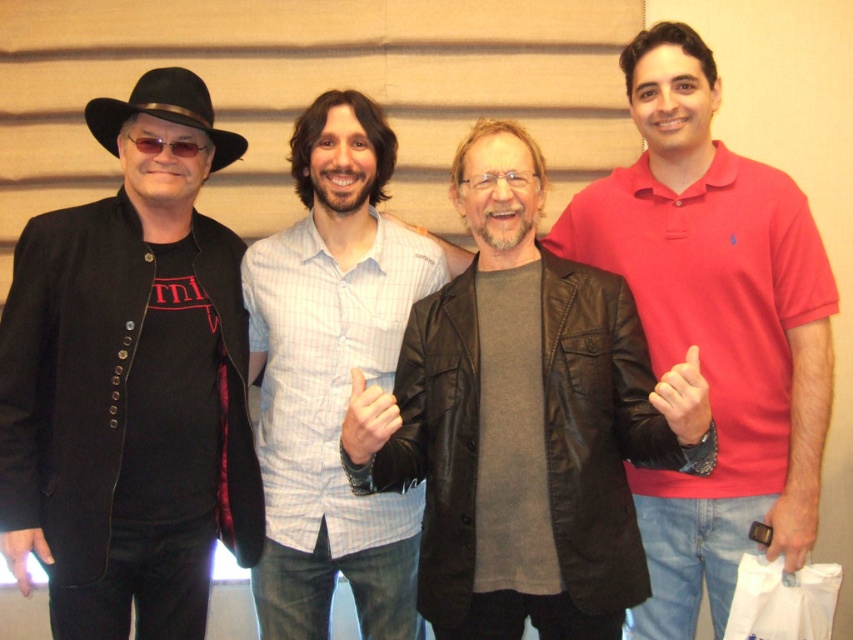
Question: Is black leather jacket at left positioned at the back of leather jacket at center?

Choices:
 (A) yes
 (B) no

Answer: (A)

Question: Is leather jacket at center smaller than light blue striped shirt at center?

Choices:
 (A) yes
 (B) no

Answer: (B)

Question: Among these points, which one is farthest from the camera?

Choices:
 (A) (172, 99)
 (B) (589, 294)
 (C) (691, 632)

Answer: (C)

Question: Which is nearer to the black leather jacket at left?

Choices:
 (A) red cotton polo shirt at right
 (B) light blue striped shirt at center
 (C) black felt fedora at upper left

Answer: (B)

Question: Among these points, which one is farthest from the camera?

Choices:
 (A) (178, 88)
 (B) (494, 426)
 (C) (287, 516)
 (D) (641, 209)

Answer: (D)

Question: In this image, where is leather jacket at center located relative to red cotton polo shirt at right?

Choices:
 (A) left
 (B) right

Answer: (A)